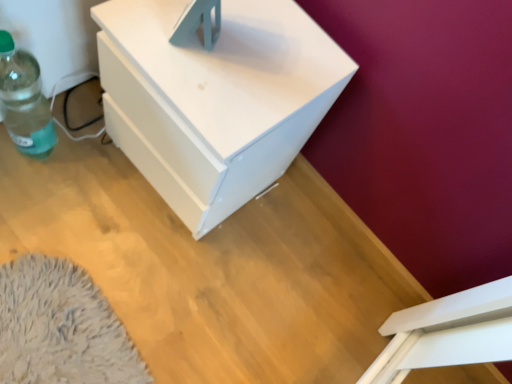
The width and height of the screenshot is (512, 384). In order to click on green translucent bottle at left in this screenshot , I will do `click(24, 101)`.

The height and width of the screenshot is (384, 512). Describe the element at coordinates (24, 101) in the screenshot. I see `green translucent bottle at left` at that location.

Measure the distance between green translucent bottle at left and camera.

The depth of green translucent bottle at left is 29.86 inches.

What do you see at coordinates (215, 99) in the screenshot? The height and width of the screenshot is (384, 512). I see `white matte nightstand at center` at bounding box center [215, 99].

Locate an element on the screen. The width and height of the screenshot is (512, 384). white matte nightstand at center is located at coordinates (215, 99).

Measure the distance between white matte nightstand at center and camera.

white matte nightstand at center and camera are 58.71 centimeters apart.

In order to face white matte nightstand at center, should I rotate leftwards or rightwards?

To face it directly, rotate left by 5.432 degrees.

Find the location of a particular element. This screenshot has height=384, width=512. green translucent bottle at left is located at coordinates (24, 101).

Is white matte nightstand at center at the left side of green translucent bottle at left?

Incorrect, white matte nightstand at center is not on the left side of green translucent bottle at left.

Who is more distant, white matte nightstand at center or green translucent bottle at left?

green translucent bottle at left.

Which is closer to the camera, (266, 74) or (42, 108)?

The point (266, 74) is more forward.

Consider the image. From the image's perspective, is white matte nightstand at center over green translucent bottle at left?

No, from the image's perspective, white matte nightstand at center is not above green translucent bottle at left.

From a real-world perspective, between white matte nightstand at center and green translucent bottle at left, who is vertically lower?

green translucent bottle at left, from a real-world perspective.

Considering the relative sizes of white matte nightstand at center and green translucent bottle at left in the image provided, is white matte nightstand at center wider than green translucent bottle at left?

Yes.

Considering the relative sizes of white matte nightstand at center and green translucent bottle at left in the image provided, is white matte nightstand at center shorter than green translucent bottle at left?

In fact, white matte nightstand at center may be taller than green translucent bottle at left.

Between white matte nightstand at center and green translucent bottle at left, which one has smaller size?

green translucent bottle at left.

Is white matte nightstand at center spatially inside green translucent bottle at left, or outside of it?

white matte nightstand at center is spatially situated outside green translucent bottle at left.

Is there a large distance between white matte nightstand at center and green translucent bottle at left?

white matte nightstand at center is near green translucent bottle at left, not far away.

Is white matte nightstand at center oriented towards green translucent bottle at left?

No, white matte nightstand at center is not oriented towards green translucent bottle at left.

How far apart are white matte nightstand at center and green translucent bottle at left?

white matte nightstand at center and green translucent bottle at left are 13.66 inches apart.

You are a GUI agent. You are given a task and a screenshot of the screen. Output one action in this format:
    pyautogui.click(x=<x>, y=<y>)
    Task: Click on the nightstand located in front of the green translucent bottle at left
    The width and height of the screenshot is (512, 384).
    Given the screenshot: What is the action you would take?
    pyautogui.click(x=215, y=99)

Is green translucent bottle at left at the left side of white matte nightstand at center?

Yes.

Which object is further away from the camera, green translucent bottle at left or white matte nightstand at center?

green translucent bottle at left is behind.

Is point (36, 98) more distant than point (133, 109)?

Yes, point (36, 98) is farther from viewer.

From the image's perspective, which is above, green translucent bottle at left or white matte nightstand at center?

green translucent bottle at left is shown above in the image.

From a real-world perspective, between green translucent bottle at left and white matte nightstand at center, who is vertically higher?

white matte nightstand at center.

Looking at their sizes, would you say green translucent bottle at left is wider or thinner than white matte nightstand at center?

Clearly, green translucent bottle at left has less width compared to white matte nightstand at center.

Can you confirm if green translucent bottle at left is shorter than white matte nightstand at center?

Indeed, green translucent bottle at left has a lesser height compared to white matte nightstand at center.

Which of these two, green translucent bottle at left or white matte nightstand at center, is bigger?

Bigger between the two is white matte nightstand at center.

Is green translucent bottle at left outside of white matte nightstand at center?

Yes, green translucent bottle at left is located beyond the bounds of white matte nightstand at center.

Can you see green translucent bottle at left touching white matte nightstand at center?

No, green translucent bottle at left is not with white matte nightstand at center.

Could you tell me if green translucent bottle at left is facing white matte nightstand at center?

No, green translucent bottle at left does not turn towards white matte nightstand at center.

In the scene shown: Can you tell me how much green translucent bottle at left and white matte nightstand at center differ in facing direction?

The angular difference between green translucent bottle at left and white matte nightstand at center is 18 degrees.

Locate an element on the screen. Image resolution: width=512 pixels, height=384 pixels. bottle behind the white matte nightstand at center is located at coordinates (24, 101).

The height and width of the screenshot is (384, 512). I want to click on bottle lying behind the white matte nightstand at center, so click(24, 101).

Where is `nightstand below the green translucent bottle at left (from the image's perspective)`? The image size is (512, 384). nightstand below the green translucent bottle at left (from the image's perspective) is located at coordinates (215, 99).